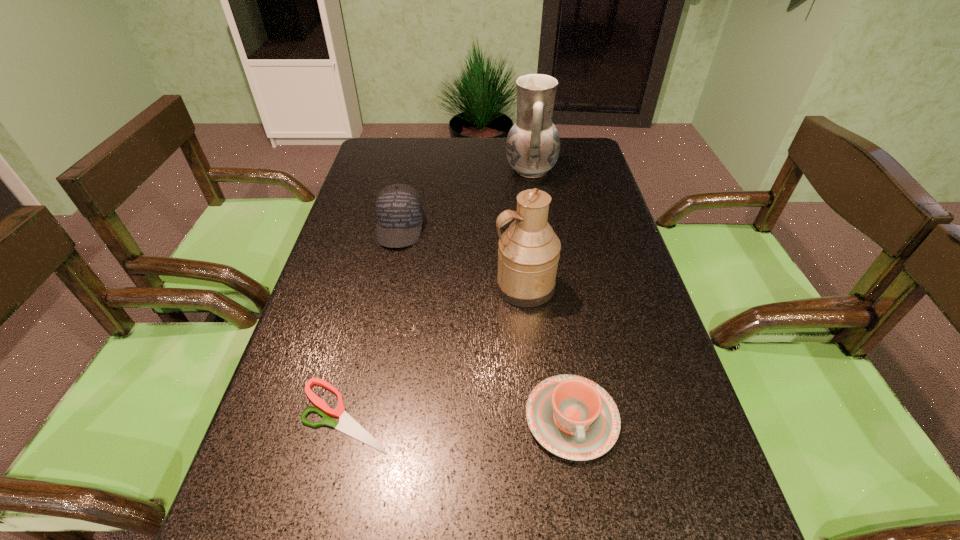
You are a GUI agent. You are given a task and a screenshot of the screen. Output one action in this format:
    pyautogui.click(x=<x>, y=<y>)
    Task: Click on the vacant region located at the front of the third shortest object where the brim is located
    Image resolution: width=960 pixels, height=540 pixels.
    Given the screenshot: What is the action you would take?
    pyautogui.click(x=382, y=314)

Find the location of a particular element. This screenshot has height=540, width=960. blank space located 0.100m on the handle side of the second shortest object is located at coordinates (589, 529).

I want to click on vacant point located 0.090m on the back of the shortest object, so click(x=363, y=344).

Identify the location of object present at the far edge. The image size is (960, 540). (533, 145).

At what (x,y) coordinates should I click in order to perform the action: click on baseball cap at the left edge. Please return your answer as a coordinate pair (x, y). Image resolution: width=960 pixels, height=540 pixels. Looking at the image, I should click on (399, 209).

At what (x,y) coordinates should I click in order to perform the action: click on scissors that is at the left edge. Please return your answer as a coordinate pair (x, y). Looking at the image, I should click on (346, 424).

Locate an element on the screen. This screenshot has width=960, height=540. pitcher that is at the right edge is located at coordinates (533, 145).

Where is `chinaware situated at the right edge`? chinaware situated at the right edge is located at coordinates (574, 418).

Locate an element on the screen. object present at the far right corner is located at coordinates (533, 145).

Locate an element on the screen. The image size is (960, 540). vacant space at the far edge of the desktop is located at coordinates (492, 156).